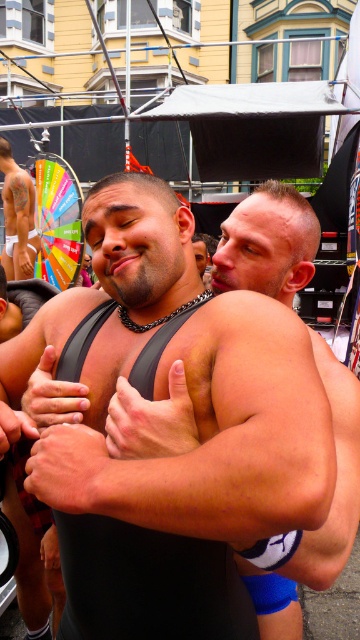
Between black matte arm at center and white skin tattooed man at left, which one has more height?

With more height is white skin tattooed man at left.

Is the position of black matte arm at center more distant than that of white skin tattooed man at left?

That is False.

Is point (79, 435) farther from camera compared to point (11, 272)?

No, it is in front of (11, 272).

At what (x,y) coordinates should I click in order to perform the action: click on black matte arm at center. Please return your answer as a coordinate pair (x, y). Looking at the image, I should click on (213, 451).

Is black matte singlet at center to the right of blue fabric shorts at center from the viewer's perspective?

Incorrect, black matte singlet at center is not on the right side of blue fabric shorts at center.

Is point (132, 189) more distant than point (236, 289)?

No, it is not.

Find the location of `black matte singlet at center`. black matte singlet at center is located at coordinates [x=187, y=378].

Which is more to the right, blue fabric shorts at center or white skin tattooed man at left?

Positioned to the right is blue fabric shorts at center.

Does blue fabric shorts at center have a greater width compared to white skin tattooed man at left?

Incorrect, blue fabric shorts at center's width does not surpass white skin tattooed man at left's.

The height and width of the screenshot is (640, 360). What do you see at coordinates (326, 520) in the screenshot? I see `blue fabric shorts at center` at bounding box center [326, 520].

Where is `blue fabric shorts at center`? This screenshot has height=640, width=360. blue fabric shorts at center is located at coordinates 326,520.